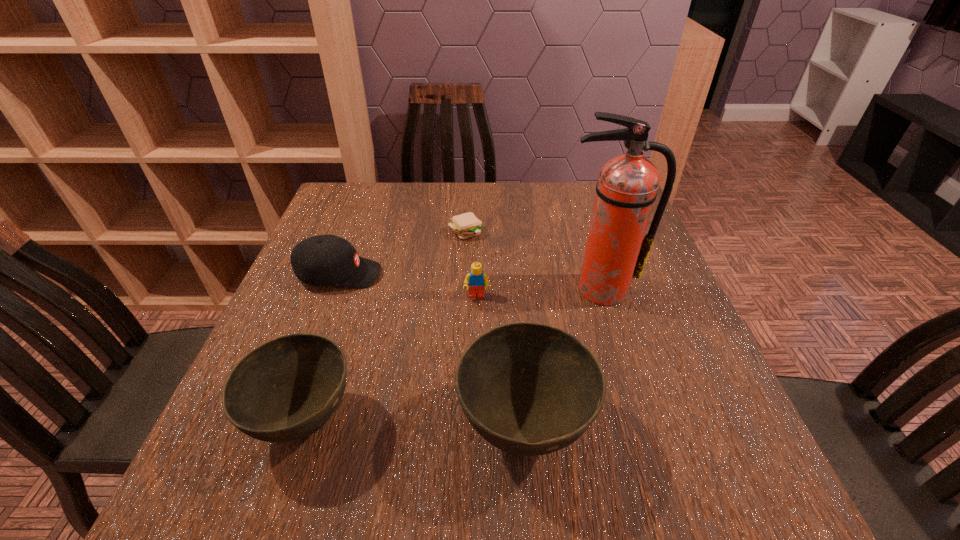
Identify the location of vacant space located 0.280m on the back of the taller bowl. (512, 279).

Where is `vacant space located 0.100m on the front of the farthest object`? The height and width of the screenshot is (540, 960). vacant space located 0.100m on the front of the farthest object is located at coordinates (464, 265).

You are a GUI agent. You are given a task and a screenshot of the screen. Output one action in this format:
    pyautogui.click(x=<x>, y=<y>)
    Task: Click on the vacant space situated at the nozzle of the tallest object
    
    Given the screenshot: What is the action you would take?
    pyautogui.click(x=616, y=345)

Where is `free location located 0.370m with a logo on the front of the baseball cap`? free location located 0.370m with a logo on the front of the baseball cap is located at coordinates (535, 274).

Image resolution: width=960 pixels, height=540 pixels. In order to click on vacant area situated on the front-facing side of the Lego in this screenshot , I will do `click(476, 327)`.

In order to click on object that is at the far edge in this screenshot , I will do click(x=466, y=225).

You are a GUI agent. You are given a task and a screenshot of the screen. Output one action in this format:
    pyautogui.click(x=<x>, y=<y>)
    Task: Click on the bowl that is at the left edge
    
    Given the screenshot: What is the action you would take?
    click(x=286, y=389)

You are a GUI agent. You are given a task and a screenshot of the screen. Output one action in this format:
    pyautogui.click(x=<x>, y=<y>)
    Task: Click on the baseball cap present at the left edge
    This screenshot has width=960, height=540.
    Given the screenshot: What is the action you would take?
    point(322,260)

Locate an element on the screen. This screenshot has width=960, height=540. object at the right edge is located at coordinates (615, 252).

The image size is (960, 540). In order to click on object that is at the near left corner in this screenshot , I will do `click(286, 389)`.